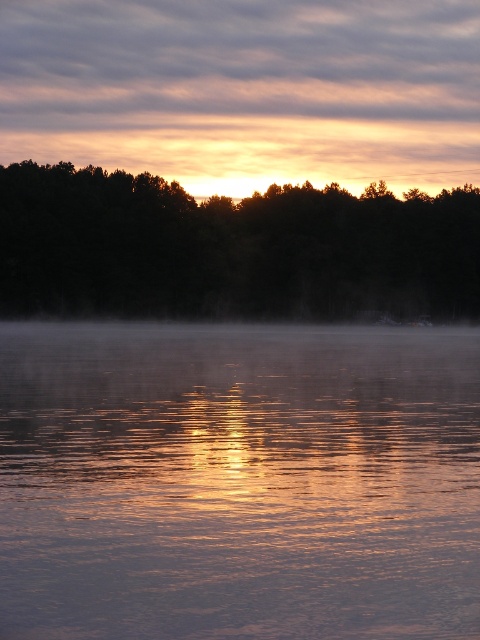
Looking at this image, who is positioned more to the right, glistening water at center or dark green forest at center?

glistening water at center is more to the right.

The width and height of the screenshot is (480, 640). What are the coordinates of `glistening water at center` in the screenshot? It's located at (239, 481).